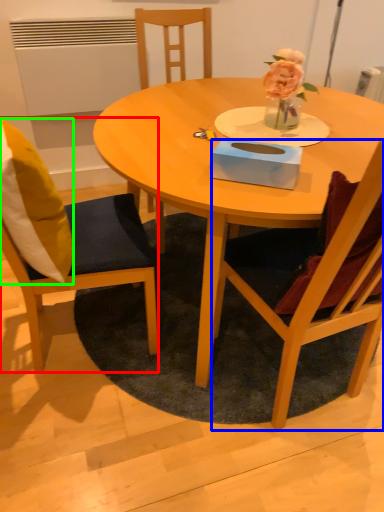
Question: Which object is positioned farthest from chair (highlighted by a red box)? Select from chair (highlighted by a blue box) and pillow (highlighted by a green box).

Choices:
 (A) chair
 (B) pillow

Answer: (A)